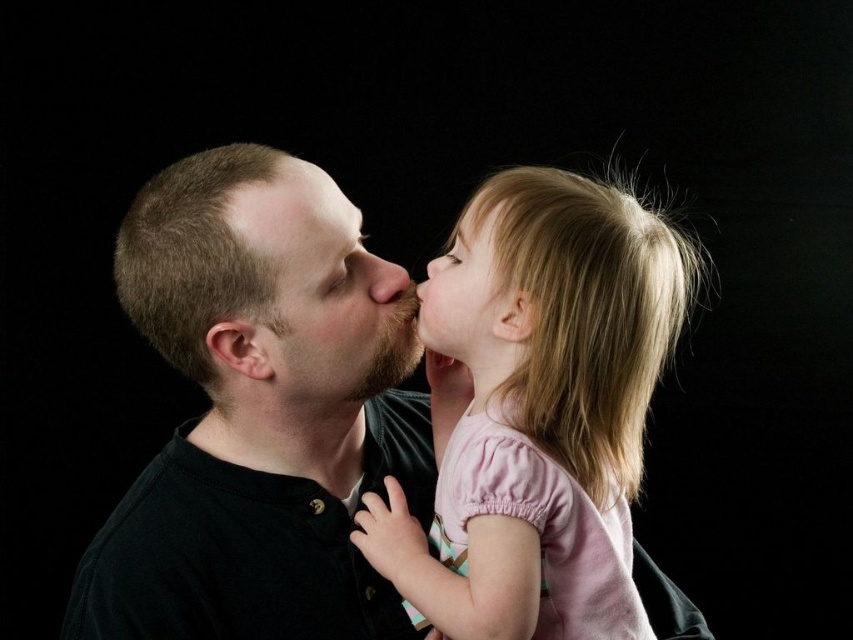
You are an artist analyzing the composition of this image. You notice two key elements in the central area of the face depicted here. The first is the smooth skin at upper center and the second is the matte brown nose at center. Which of these elements is located to the left of the other?

The smooth skin at upper center is positioned on the left side of matte brown nose at center.

You are an artist observing the scene. You notice two elements in the image, the smooth skin at upper center and the matte brown nose at center. Which of these two elements is positioned higher in the image?

The smooth skin at upper center is located above the matte brown nose at center, so it is positioned higher in the image.